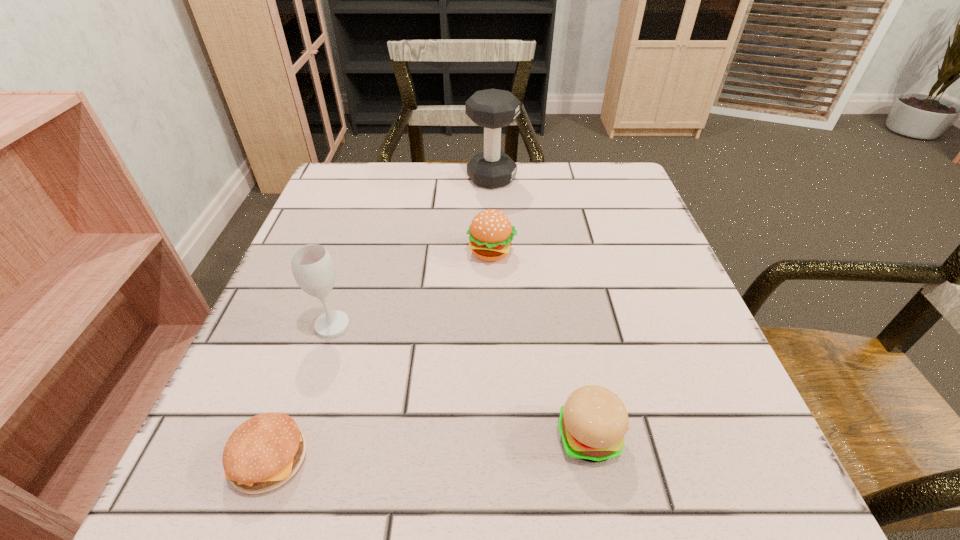
Where is `free spot between the shortest object and the rightmost object`? This screenshot has width=960, height=540. free spot between the shortest object and the rightmost object is located at coordinates (430, 447).

This screenshot has height=540, width=960. In order to click on vacant point located between the wineglass and the farthest object in this screenshot , I will do `click(412, 252)`.

Locate an element on the screen. Image resolution: width=960 pixels, height=540 pixels. unoccupied area between the wineglass and the tallest object is located at coordinates (412, 252).

The height and width of the screenshot is (540, 960). I want to click on empty space that is in between the fourth shortest object and the leftmost hamburger, so click(x=301, y=392).

The image size is (960, 540). What are the coordinates of `the closest object to the shortest hamburger` in the screenshot? It's located at (313, 269).

Where is `object that is the closest one to the shortest hamburger`? Image resolution: width=960 pixels, height=540 pixels. object that is the closest one to the shortest hamburger is located at coordinates (313, 269).

Locate which hamburger ranks second in proximity to the dumbbell. Please provide its 2D coordinates. Your answer should be formatted as a tuple, i.e. [(x, y)], where the tuple contains the x and y coordinates of a point satisfying the conditions above.

[(592, 424)]

This screenshot has width=960, height=540. In order to click on hamburger that is the second closest to the second tallest hamburger in this screenshot , I will do `click(265, 451)`.

Locate an element on the screen. This screenshot has width=960, height=540. blank space that satisfies the following two spatial constraints: 1. on the back side of the shortest hamburger; 2. on the right side of the dumbbell is located at coordinates (370, 178).

You are a GUI agent. You are given a task and a screenshot of the screen. Output one action in this format:
    pyautogui.click(x=<x>, y=<y>)
    Task: Click on the vacant area that satisfies the following two spatial constraints: 1. on the back side of the second hamburger from right to left; 2. on the left side of the shortest object
    Image resolution: width=960 pixels, height=540 pixels.
    Given the screenshot: What is the action you would take?
    pyautogui.click(x=344, y=252)